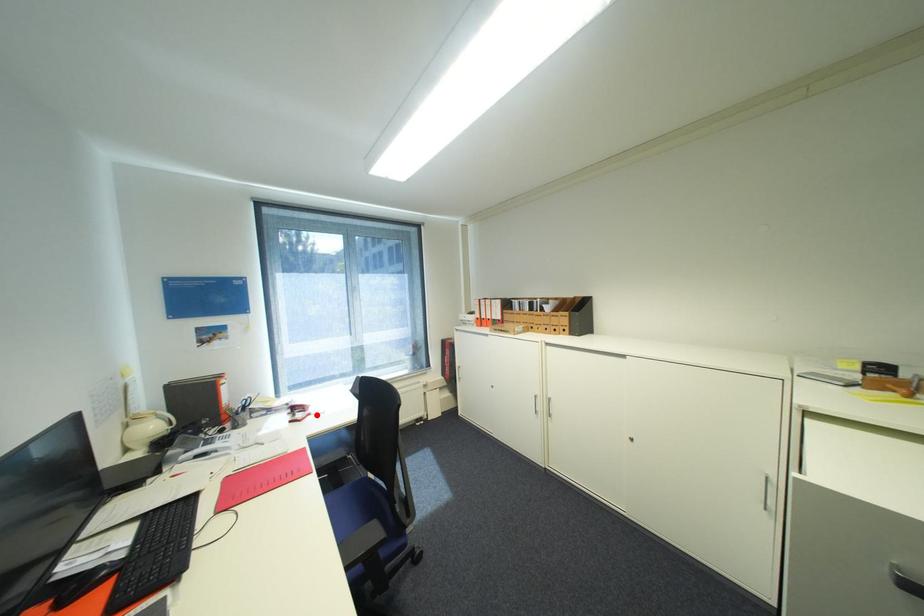
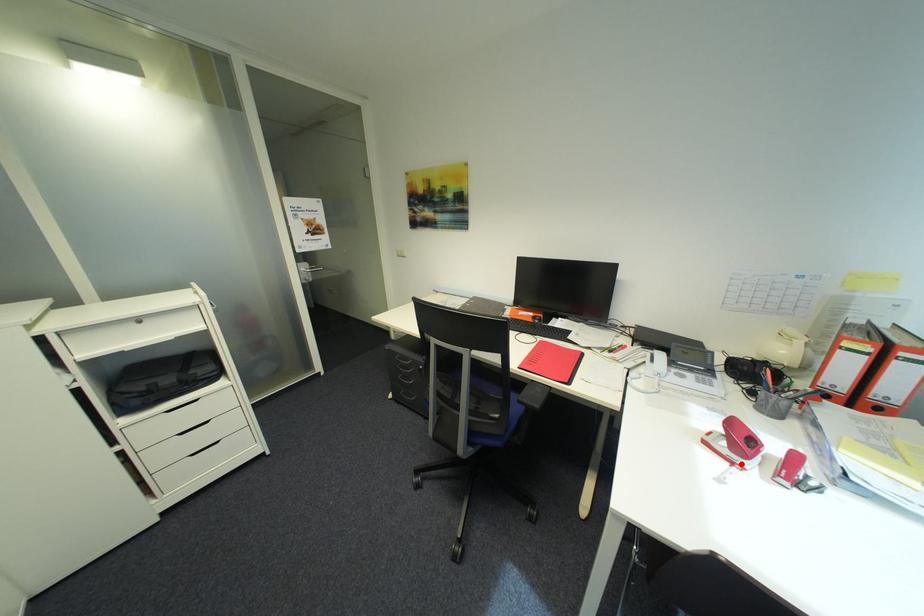
I am providing you with two images of the same scene from different viewpoints. A red point is marked on the first image and another point is marked on the second image. Do the highlighted points in image1 and image2 indicate the same real-world spot?

Yes